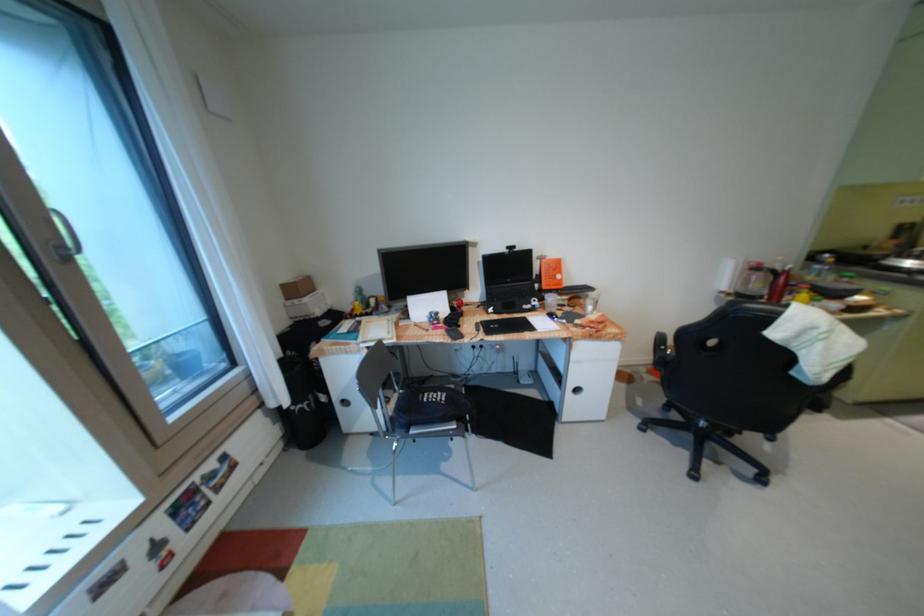
Find the location of `red thermos bottle`. red thermos bottle is located at coordinates (783, 283).